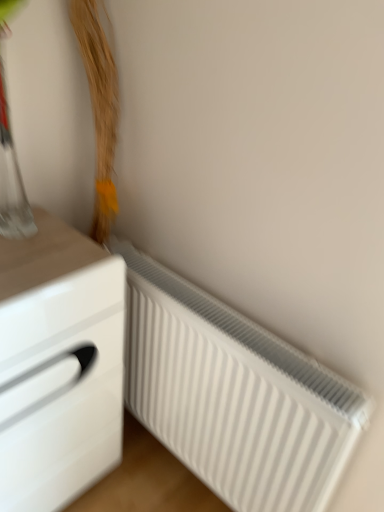
What is the approximate height of white ribbed radiator at lower right?

white ribbed radiator at lower right is 26.91 inches tall.

Describe the element at coordinates (233, 395) in the screenshot. I see `white ribbed radiator at lower right` at that location.

In order to face white ribbed radiator at lower right, should I rotate leftwards or rightwards?

Turn right by 0.279 degrees to look at white ribbed radiator at lower right.

Locate an element on the screen. white ribbed radiator at lower right is located at coordinates point(233,395).

Where is `white glossy chest of drawers at left`? white glossy chest of drawers at left is located at coordinates (58, 365).

This screenshot has width=384, height=512. What do you see at coordinates (58, 365) in the screenshot?
I see `white glossy chest of drawers at left` at bounding box center [58, 365].

Where is `white ribbed radiator at lower right`? This screenshot has width=384, height=512. white ribbed radiator at lower right is located at coordinates (233, 395).

Considering the relative positions of white glossy chest of drawers at left and white ribbed radiator at lower right in the image provided, is white glossy chest of drawers at left to the left of white ribbed radiator at lower right from the viewer's perspective?

Yes, white glossy chest of drawers at left is to the left of white ribbed radiator at lower right.

Does white glossy chest of drawers at left come behind white ribbed radiator at lower right?

No, it is in front of white ribbed radiator at lower right.

Does point (2, 370) come in front of point (308, 358)?

Yes, point (2, 370) is in front of point (308, 358).

From the image's perspective, who appears lower, white glossy chest of drawers at left or white ribbed radiator at lower right?

white ribbed radiator at lower right appears lower in the image.

From a real-world perspective, is white glossy chest of drawers at left physically above white ribbed radiator at lower right?

Yes.

Is white glossy chest of drawers at left wider or thinner than white ribbed radiator at lower right?

Clearly, white glossy chest of drawers at left has more width compared to white ribbed radiator at lower right.

Between white glossy chest of drawers at left and white ribbed radiator at lower right, which one has more height?

Standing taller between the two is white glossy chest of drawers at left.

Based on their sizes in the image, would you say white glossy chest of drawers at left is bigger or smaller than white ribbed radiator at lower right?

In the image, white glossy chest of drawers at left appears to be larger than white ribbed radiator at lower right.

Would you say white glossy chest of drawers at left is inside or outside white ribbed radiator at lower right?

white glossy chest of drawers at left is spatially situated outside white ribbed radiator at lower right.

Are white glossy chest of drawers at left and white ribbed radiator at lower right making contact?

There is a gap between white glossy chest of drawers at left and white ribbed radiator at lower right.

Is white glossy chest of drawers at left turned away from white ribbed radiator at lower right?

No, white glossy chest of drawers at left's orientation is not away from white ribbed radiator at lower right.

Image resolution: width=384 pixels, height=512 pixels. In order to click on radiator that is under the white glossy chest of drawers at left (from a real-world perspective) in this screenshot , I will do `click(233, 395)`.

Considering the positions of objects white ribbed radiator at lower right and white glossy chest of drawers at left in the image provided, who is more to the left, white ribbed radiator at lower right or white glossy chest of drawers at left?

Positioned to the left is white glossy chest of drawers at left.

Which object is further away from the camera, white ribbed radiator at lower right or white glossy chest of drawers at left?

white ribbed radiator at lower right is further away from the camera.

Is point (227, 346) farther from viewer compared to point (21, 489)?

That is False.

From the image's perspective, is white ribbed radiator at lower right located beneath white glossy chest of drawers at left?

Indeed, from the image's perspective, white ribbed radiator at lower right is shown beneath white glossy chest of drawers at left.

From a real-world perspective, who is located lower, white ribbed radiator at lower right or white glossy chest of drawers at left?

white ribbed radiator at lower right.

In the scene shown: Is white ribbed radiator at lower right wider than white glossy chest of drawers at left?

Incorrect, the width of white ribbed radiator at lower right does not surpass that of white glossy chest of drawers at left.

Who is shorter, white ribbed radiator at lower right or white glossy chest of drawers at left?

white ribbed radiator at lower right is shorter.

Who is smaller, white ribbed radiator at lower right or white glossy chest of drawers at left?

Smaller between the two is white ribbed radiator at lower right.

Based on the photo, is white ribbed radiator at lower right situated inside white glossy chest of drawers at left or outside?

white ribbed radiator at lower right is not inside white glossy chest of drawers at left, it's outside.

Is white ribbed radiator at lower right not close to white glossy chest of drawers at left?

No.

Is white ribbed radiator at lower right facing towards white glossy chest of drawers at left?

Yes, white ribbed radiator at lower right is facing white glossy chest of drawers at left.

What's the angular difference between white ribbed radiator at lower right and white glossy chest of drawers at left's facing directions?

The angular difference between white ribbed radiator at lower right and white glossy chest of drawers at left is 89.2 degrees.

Identify the location of radiator behind the white glossy chest of drawers at left. (233, 395).

The width and height of the screenshot is (384, 512). I want to click on chest of drawers that appears on the left of white ribbed radiator at lower right, so click(58, 365).

This screenshot has width=384, height=512. Find the location of `radiator that appears behind the white glossy chest of drawers at left`. radiator that appears behind the white glossy chest of drawers at left is located at coordinates (233, 395).